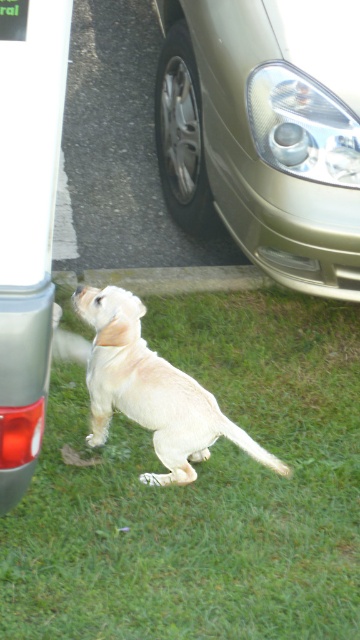
Question: Where is green grass at lower center located in relation to gold metallic car at upper center in the image?

Choices:
 (A) above
 (B) below

Answer: (B)

Question: Which of the following is the farthest from the observer?

Choices:
 (A) light beige fur dog at center
 (B) gold metallic car at upper center

Answer: (B)

Question: Which object is farther from the camera taking this photo?

Choices:
 (A) metallic gold car at center
 (B) gold metallic car at upper center
 (C) light beige fur dog at center
 (D) green grass at lower center

Answer: (B)

Question: Estimate the real-world distances between objects in this image. Which object is closer to the gold metallic car at upper center?

Choices:
 (A) green grass at lower center
 (B) metallic gold car at center

Answer: (A)

Question: Is green grass at lower center smaller than gold metallic car at upper center?

Choices:
 (A) no
 (B) yes

Answer: (A)

Question: From the image, what is the correct spatial relationship of green grass at lower center in relation to metallic gold car at center?

Choices:
 (A) left
 (B) right

Answer: (B)